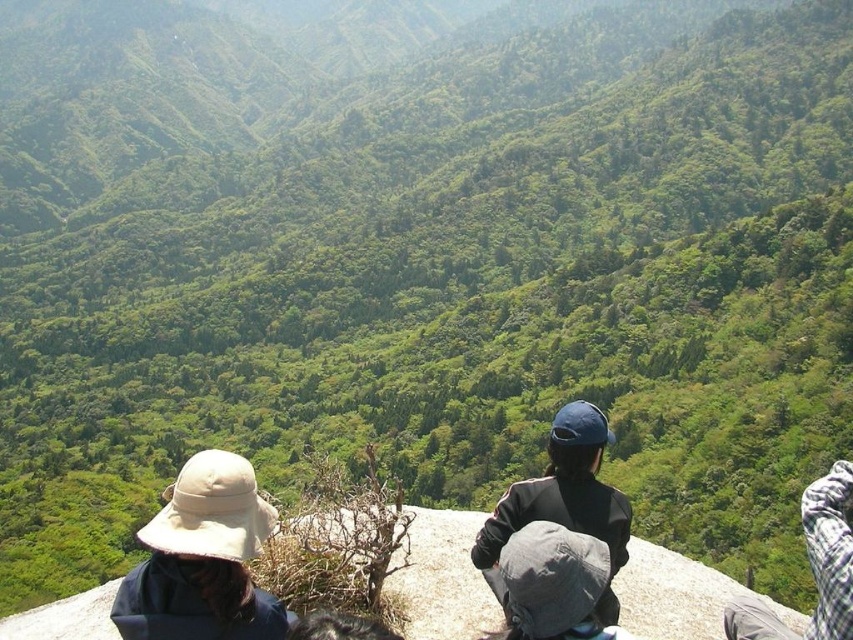
You are a photographer planning to take a group photo of the beige fabric hat at lower left and the dark blue fabric jacket at center. Since you want to ensure both subjects are fully visible, which subject should you adjust the camera angle upwards to focus on?

You should adjust the camera angle upwards to focus on the beige fabric hat at lower left because it has a greater height compared to the dark blue fabric jacket at center.

You are a photographer planning to take a photo of the dark blue fabric jacket at center and the gray fabric hat at center. Which object should you focus on first to ensure both are in sharp focus?

You should focus on the dark blue fabric jacket at center first because it is closer to you than the gray fabric hat at center, ensuring both will be in focus when focused on the closer object.